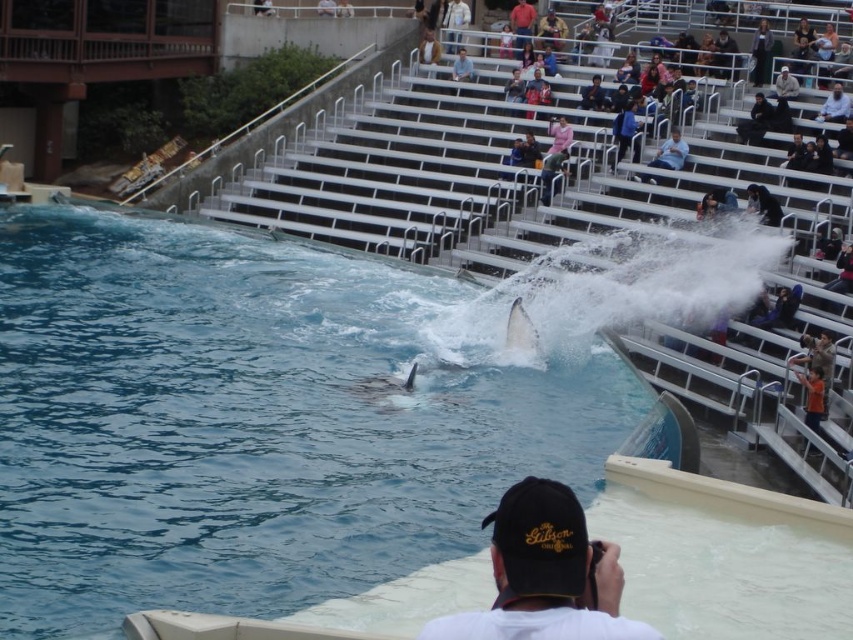
Which is behind, point (613, 620) or point (631, 109)?

Positioned behind is point (631, 109).

Does black fabric cap at lower center have a greater width compared to blue fabric jacket at upper center?

Yes.

Is point (573, 579) in front of point (616, 138)?

Yes, it is in front of point (616, 138).

This screenshot has height=640, width=853. What are the coordinates of `black fabric cap at lower center` in the screenshot? It's located at (544, 573).

Who is more distant from viewer, (537,344) or (614,136)?

The point (614,136) is more distant.

Looking at this image, who is more distant from viewer, (515, 340) or (618, 113)?

Point (618, 113)

At what (x,y) coordinates should I click in order to perform the action: click on white smooth dolphin at center. Please return your answer as a coordinate pair (x, y). Looking at the image, I should click on (520, 330).

Which is in front, point (613, 168) or point (767, 65)?

Point (613, 168) is in front.

Can you confirm if blue fabric jacket at upper center is thinner than black leather jacket at upper center?

Incorrect, blue fabric jacket at upper center's width is not less than black leather jacket at upper center's.

Where is `blue fabric jacket at upper center`? This screenshot has height=640, width=853. blue fabric jacket at upper center is located at coordinates coord(624,131).